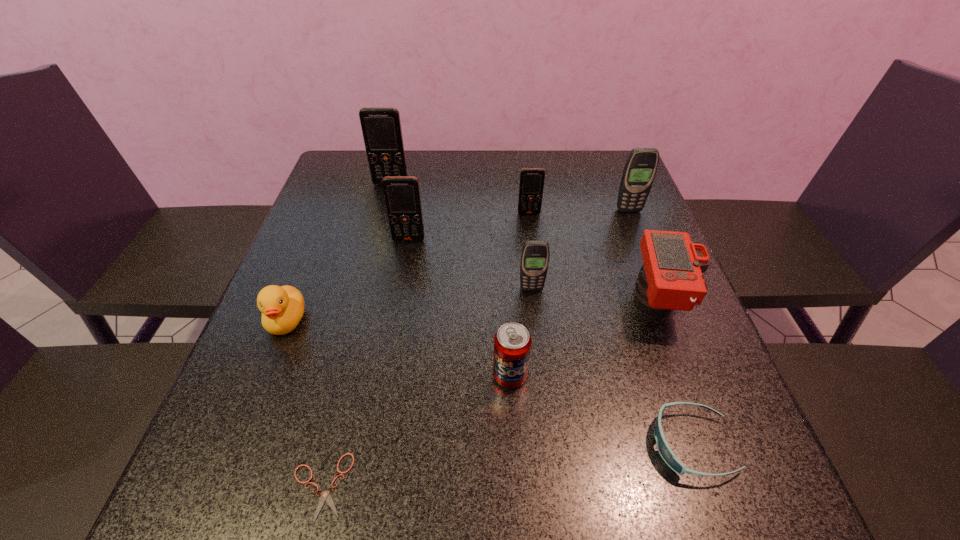
What are the coordinates of `free location that satisfies the following two spatial constraints: 1. at the beak of the eighth farthest object; 2. on the right side of the leftmost object` in the screenshot? It's located at (265, 375).

The image size is (960, 540). Identify the location of vacant position in the image that satisfies the following two spatial constraints: 1. on the screen of the camera; 2. on the right side of the farthest object. (x=361, y=302).

This screenshot has width=960, height=540. Identify the location of vacant area that satisfies the following two spatial constraints: 1. on the front side of the camera; 2. on the front-facing side of the goggles. (716, 444).